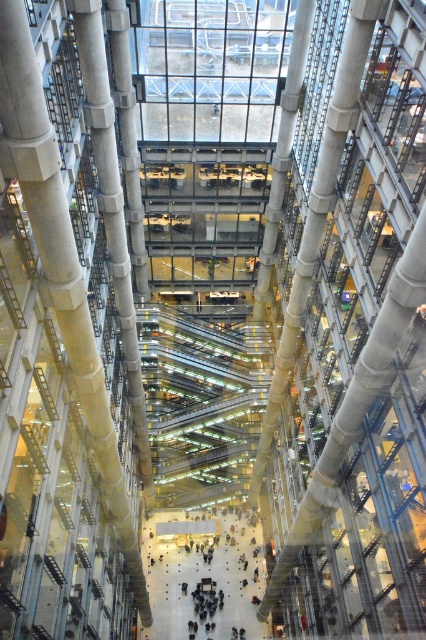
Between concrete pillar at center and dark gray concrete floor at center, which one has more height?

With more height is concrete pillar at center.

Who is higher up, concrete pillar at center or dark gray concrete floor at center?

Positioned higher is concrete pillar at center.

Between point (55, 182) and point (178, 516), which one is positioned behind?

The point (178, 516) is more distant.

Identify the location of concrete pillar at center. The height and width of the screenshot is (640, 426). (60, 262).

Can you confirm if concrete pillar at center is positioned to the left of concrete textured pillar at center?

Incorrect, concrete pillar at center is not on the left side of concrete textured pillar at center.

Image resolution: width=426 pixels, height=640 pixels. Describe the element at coordinates (60, 262) in the screenshot. I see `concrete pillar at center` at that location.

Is point (100, 420) behind point (92, 56)?

Yes, point (100, 420) is behind point (92, 56).

The image size is (426, 640). I want to click on concrete pillar at center, so click(60, 262).

Between point (203, 556) and point (92, 51), which one is positioned behind?

Point (203, 556)

Is dark gray concrete floor at center thinner than concrete textured pillar at center?

No, dark gray concrete floor at center is not thinner than concrete textured pillar at center.

Which is behind, point (210, 516) or point (124, 285)?

Positioned behind is point (210, 516).

This screenshot has width=426, height=640. What are the coordinates of `dark gray concrete floor at center` in the screenshot? It's located at click(201, 576).